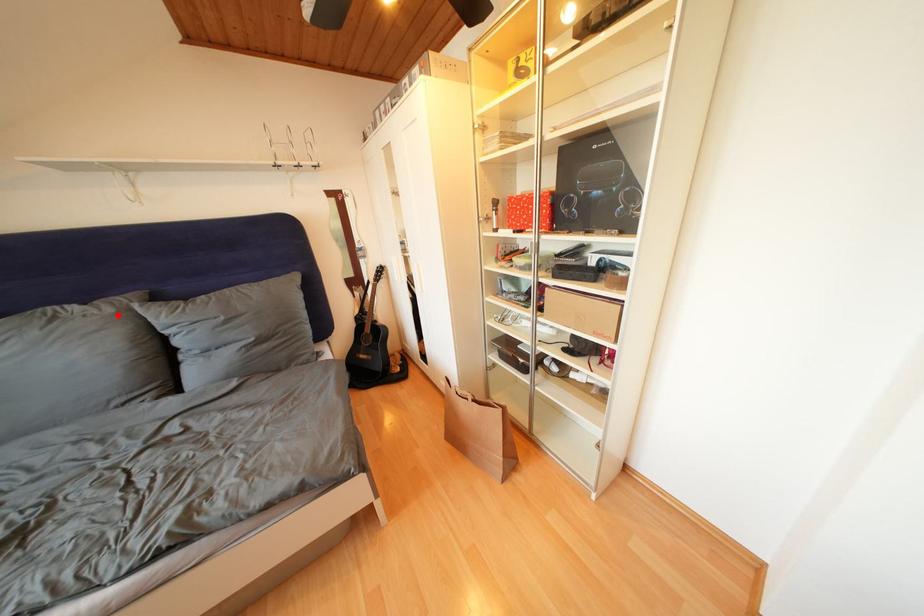
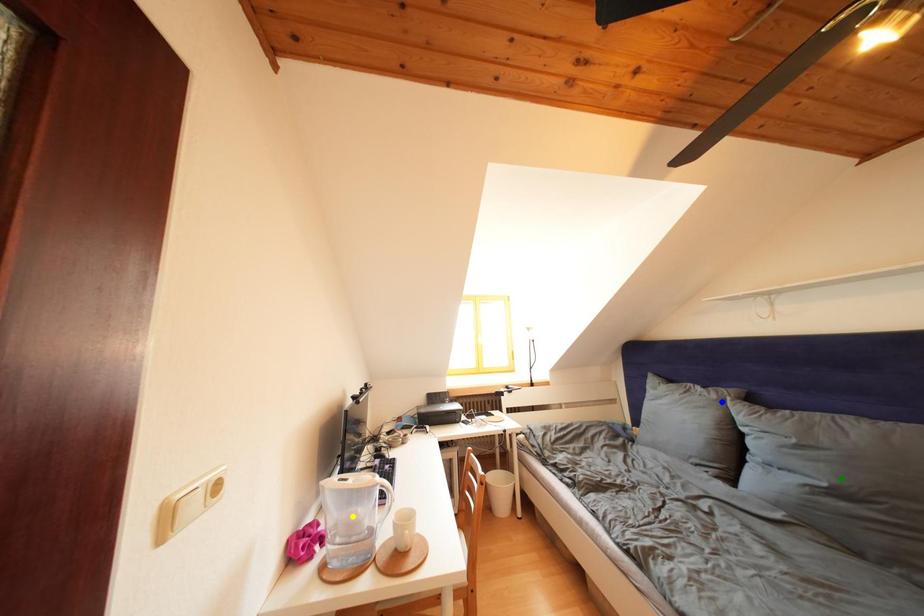
Question: I am providing you with two images of the same scene from different viewpoints. A red point is marked on the first image. You are given multiple points on the second image. Which mark in image 2 goes with the point in image 1?

Choices:
 (A) blue point
 (B) green point
 (C) yellow point

Answer: (A)